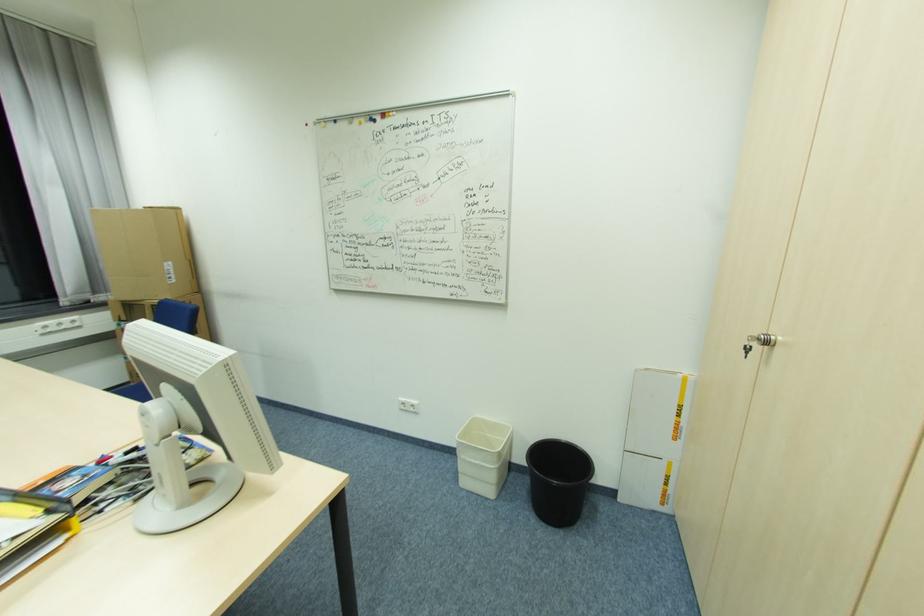
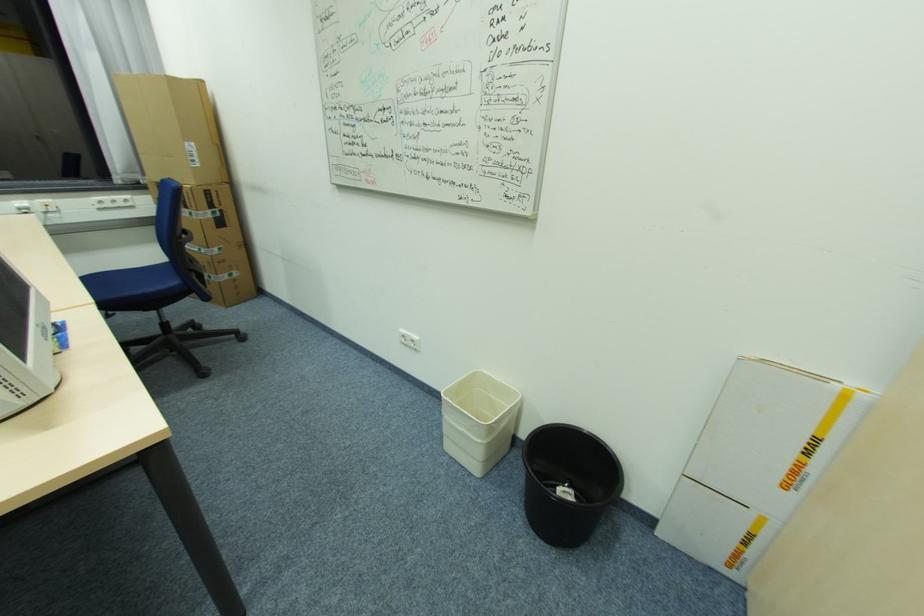
Locate, in the second image, the point that corresponds to (x=681, y=430) in the first image.

(797, 472)